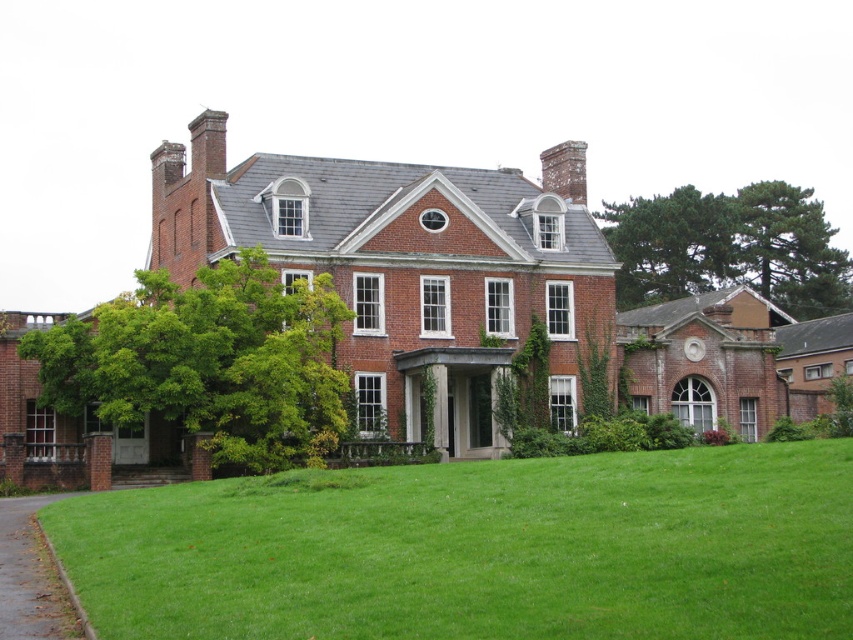
Which is above, green leafy tree at left or green leafy tree at upper right?

A: green leafy tree at upper right

Is green leafy tree at left above green leafy tree at upper right?

No, green leafy tree at left is not above green leafy tree at upper right.

Is point (300, 417) farther from camera compared to point (631, 236)?

No.

You are a GUI agent. You are given a task and a screenshot of the screen. Output one action in this format:
    pyautogui.click(x=<x>, y=<y>)
    Task: Click on the green leafy tree at left
    
    Given the screenshot: What is the action you would take?
    pos(209,362)

Is brick mansion at center thinner than green leafy tree at upper right?

In fact, brick mansion at center might be wider than green leafy tree at upper right.

Is brick mansion at center positioned before green leafy tree at upper right?

Yes.

Is point (480, 336) behind point (762, 200)?

No.

Locate an element on the screen. The width and height of the screenshot is (853, 640). brick mansion at center is located at coordinates (374, 323).

Which is more to the right, green grass at lower left or green leafy tree at upper right?

Positioned to the right is green leafy tree at upper right.

Does point (846, 541) lie behind point (778, 180)?

No.

Is point (824, 572) closer to camera compared to point (849, 304)?

Yes, it is in front of point (849, 304).

I want to click on green grass at lower left, so click(x=480, y=548).